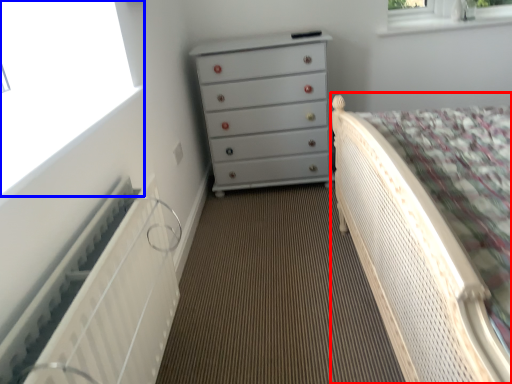
Question: Which of the following is the farthest to the observer, bed (highlighted by a red box) or window (highlighted by a blue box)?

Choices:
 (A) bed
 (B) window

Answer: (B)